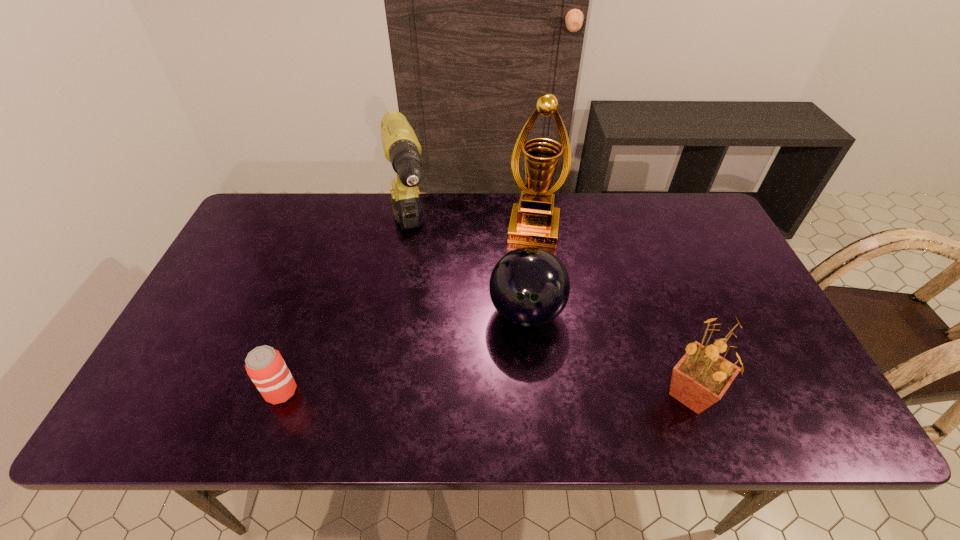
The image size is (960, 540). I want to click on free space between the beer can and the fourth object from right to left, so click(x=346, y=313).

Image resolution: width=960 pixels, height=540 pixels. In order to click on vacant space in between the award and the leftmost object in this screenshot , I will do `click(407, 310)`.

You are a GUI agent. You are given a task and a screenshot of the screen. Output one action in this format:
    pyautogui.click(x=<x>, y=<y>)
    Task: Click on the object identified as the closest to the beer can
    The width and height of the screenshot is (960, 540).
    Given the screenshot: What is the action you would take?
    pyautogui.click(x=401, y=147)

Choose which object is the nearest neighbor to the sunflower. Please provide its 2D coordinates. Your answer should be formatted as a tuple, i.e. [(x, y)], where the tuple contains the x and y coordinates of a point satisfying the conditions above.

[(529, 286)]

Where is `vacant space that satisfies the following two spatial constraints: 1. on the front side of the second shortest object; 2. at the front of the sunflower with flowers visible`? Image resolution: width=960 pixels, height=540 pixels. vacant space that satisfies the following two spatial constraints: 1. on the front side of the second shortest object; 2. at the front of the sunflower with flowers visible is located at coordinates (534, 394).

The width and height of the screenshot is (960, 540). What are the coordinates of `free region that satisfies the following two spatial constraints: 1. on the front side of the rightmost object; 2. at the front of the second object from left to right with flowers visible` in the screenshot? It's located at (384, 394).

Identify the location of vacant space that satisfies the following two spatial constraints: 1. on the front side of the shortest object; 2. at the front of the third shortest object with flowers visible. (280, 394).

Where is `blank area in the image that satisfies the following two spatial constraints: 1. on the front side of the third tallest object; 2. at the front of the tallest object with flowers visible`? blank area in the image that satisfies the following two spatial constraints: 1. on the front side of the third tallest object; 2. at the front of the tallest object with flowers visible is located at coordinates pos(556,394).